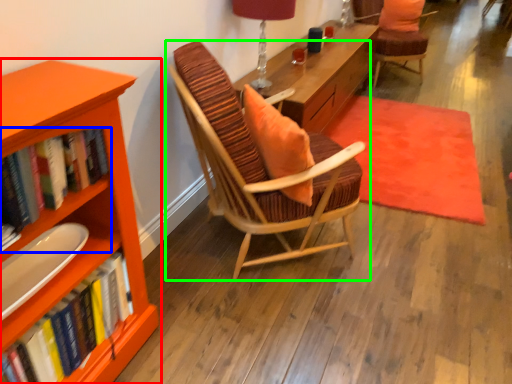
Question: Which object is the closest to the bookcase (highlighted by a red box)? Choose among these: book (highlighted by a blue box) or chair (highlighted by a green box).

Choices:
 (A) book
 (B) chair

Answer: (A)